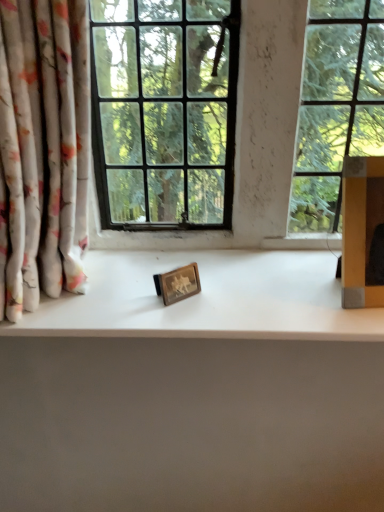
You are a GUI agent. You are given a task and a screenshot of the screen. Output one action in this format:
    pyautogui.click(x=<x>, y=<y>)
    Task: Click on the vacant area situated to the left side of yellow cardboard box at right
    This screenshot has width=384, height=512.
    Given the screenshot: What is the action you would take?
    pyautogui.click(x=299, y=317)